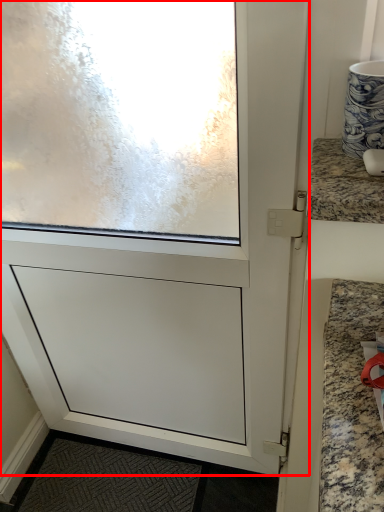
Question: Considering the relative positions of screen door (annotated by the red box) and countertop in the image provided, where is screen door (annotated by the red box) located with respect to the staircase?

Choices:
 (A) right
 (B) left

Answer: (B)